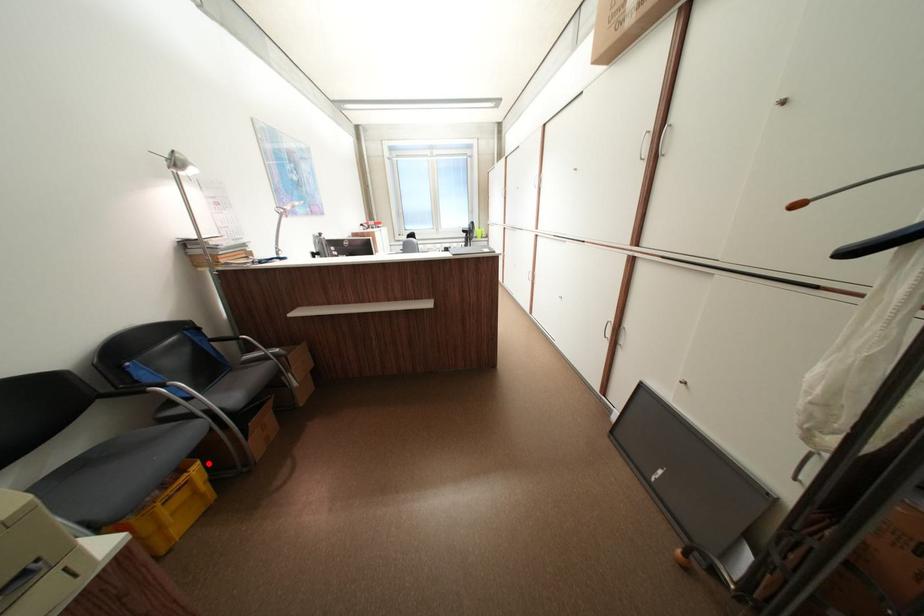
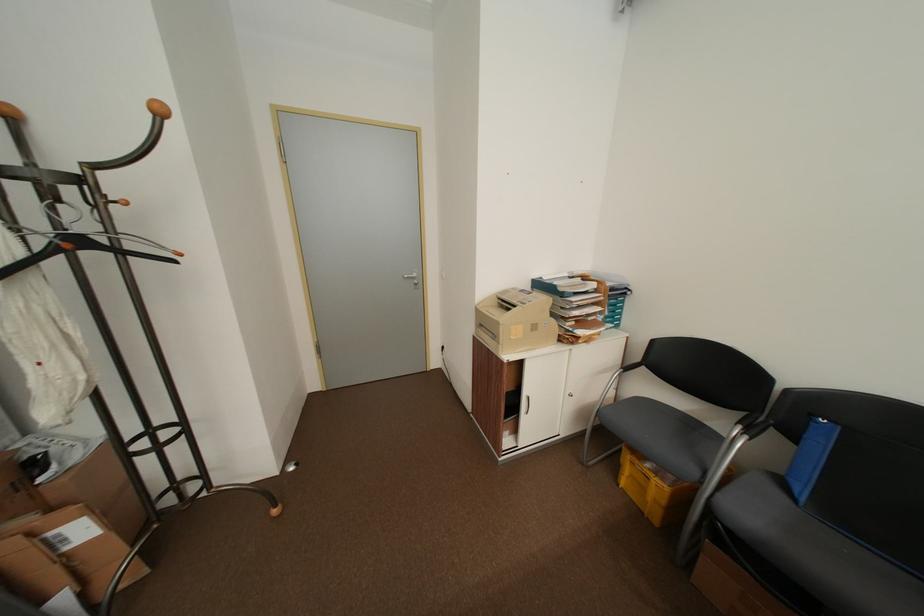
Find the pixel in the second image that matches the highlighted location in the first image.

(676, 488)